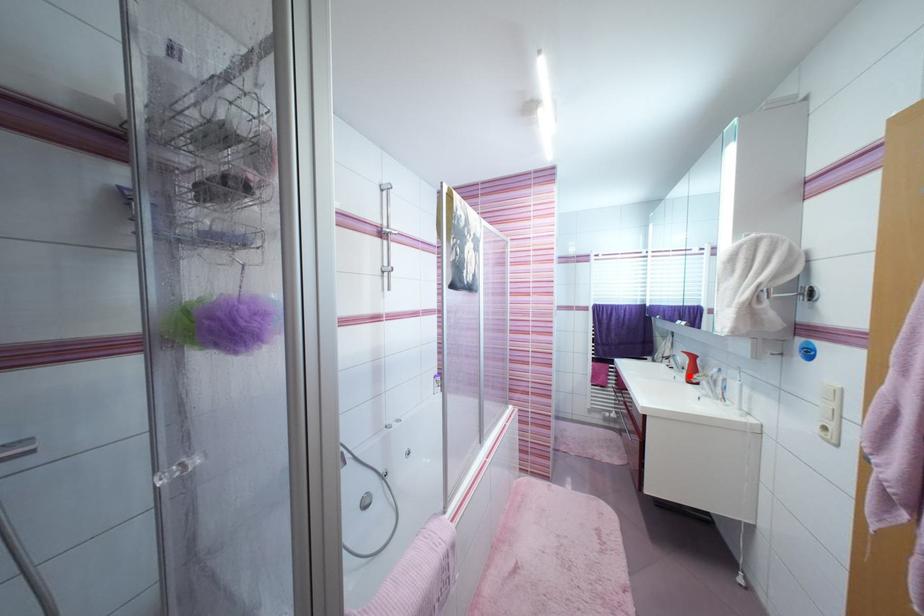
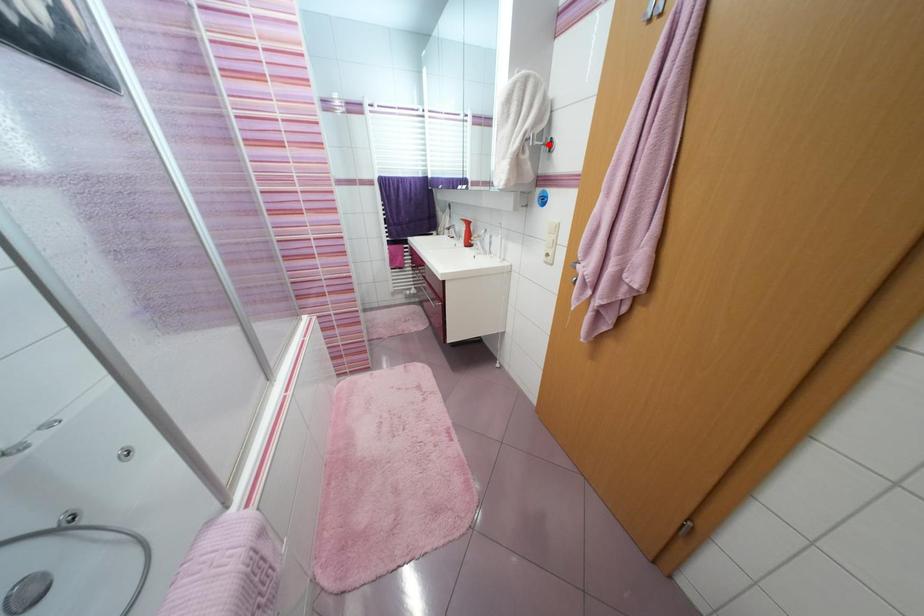
I am providing you with two images of the same scene from different viewpoints. A red point is marked on the first image and another point is marked on the second image. Are the points marked in image1 and image2 representing the same 3D position?

No